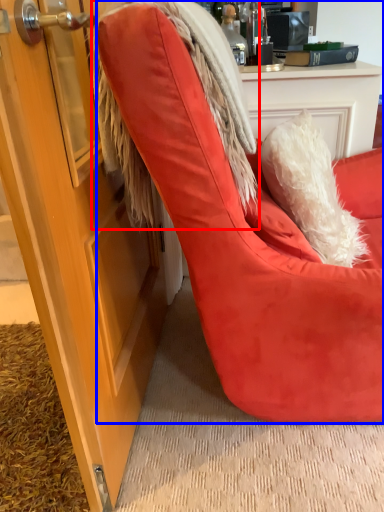
Question: Which of the following is the closest to the observer, fur coat (highlighted by a red box) or chair (highlighted by a blue box)?

Choices:
 (A) fur coat
 (B) chair

Answer: (B)